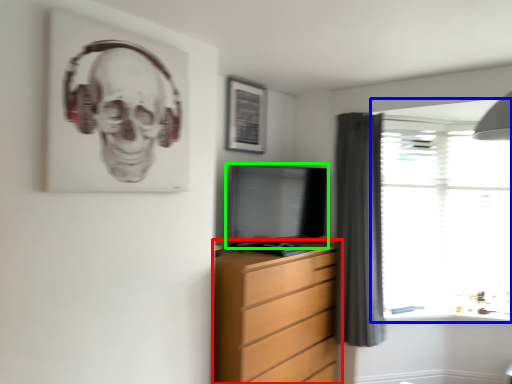
Question: Estimate the real-world distances between objects in this image. Which object is closer to chest of drawers (highlighted by a red box), window (highlighted by a blue box) or television (highlighted by a green box)?

Choices:
 (A) window
 (B) television

Answer: (B)